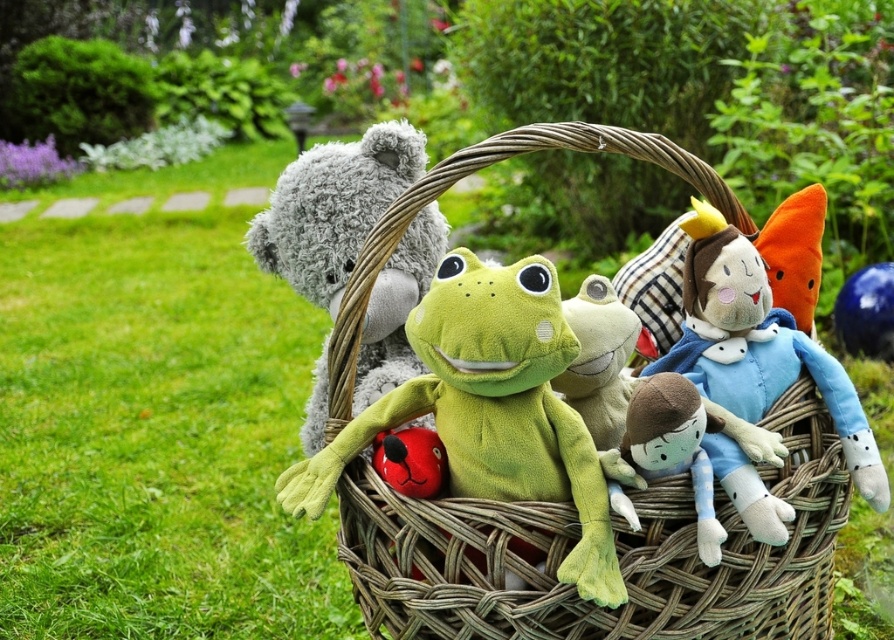
What do you see at coordinates (616, 550) in the screenshot? Image resolution: width=894 pixels, height=640 pixels. I see `woven wicker basket at center` at bounding box center [616, 550].

Locate an element on the screen. This screenshot has height=640, width=894. woven wicker basket at center is located at coordinates (616, 550).

Does point (741, 604) lie behind point (305, 499)?

Yes, it is.

The width and height of the screenshot is (894, 640). In order to click on woven wicker basket at center in this screenshot , I will do `click(616, 550)`.

Can you confirm if woven wicker basket at center is taller than blue plush doll at center?

Indeed, woven wicker basket at center has a greater height compared to blue plush doll at center.

Between woven wicker basket at center and blue plush doll at center, which one has more height?

Standing taller between the two is woven wicker basket at center.

Which is in front, point (753, 586) or point (879, 497)?

Point (753, 586) is in front.

Where is `woven wicker basket at center`? woven wicker basket at center is located at coordinates (616, 550).

Between green plush frog at center and blue plush doll at center, which one appears on the left side from the viewer's perspective?

From the viewer's perspective, green plush frog at center appears more on the left side.

The width and height of the screenshot is (894, 640). What do you see at coordinates (491, 410) in the screenshot?
I see `green plush frog at center` at bounding box center [491, 410].

Which is in front, point (437, 312) or point (887, 497)?

Point (437, 312) is in front.

Where is `green plush frog at center`? green plush frog at center is located at coordinates (491, 410).